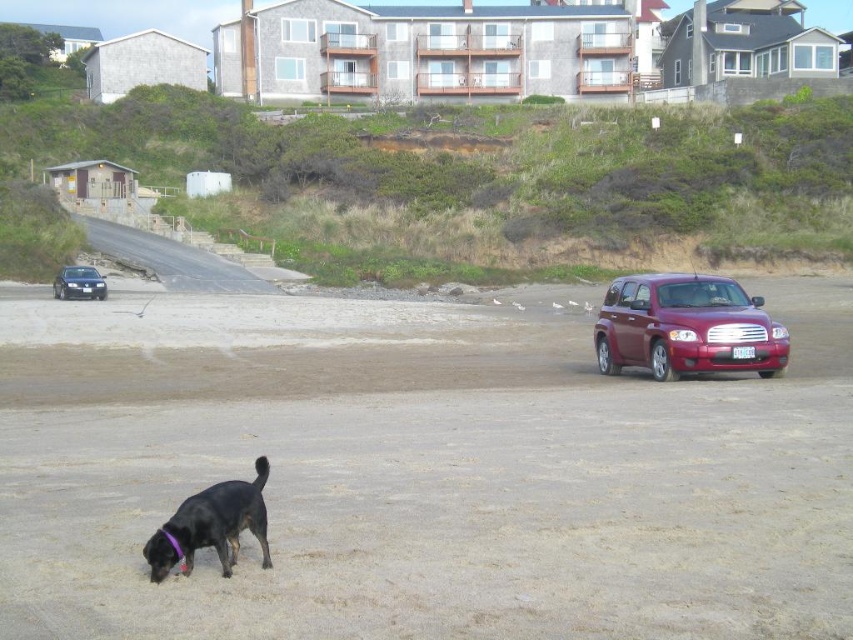
Question: Which point is closer to the camera taking this photo?

Choices:
 (A) (202, 545)
 (B) (743, 316)

Answer: (A)

Question: Is black fur dog at lower left positioned in front of shiny black sedan at left?

Choices:
 (A) yes
 (B) no

Answer: (A)

Question: Can you confirm if sandy beach at lower center is smaller than shiny maroon suv at right?

Choices:
 (A) yes
 (B) no

Answer: (A)

Question: Can you confirm if shiny maroon suv at right is positioned below shiny black sedan at left?

Choices:
 (A) yes
 (B) no

Answer: (A)

Question: Which point is closer to the camera?

Choices:
 (A) shiny black sedan at left
 (B) black fur dog at lower left
 (C) sandy beach at lower center

Answer: (C)

Question: Among these points, which one is farthest from the camera?

Choices:
 (A) (242, 529)
 (B) (753, 310)

Answer: (B)